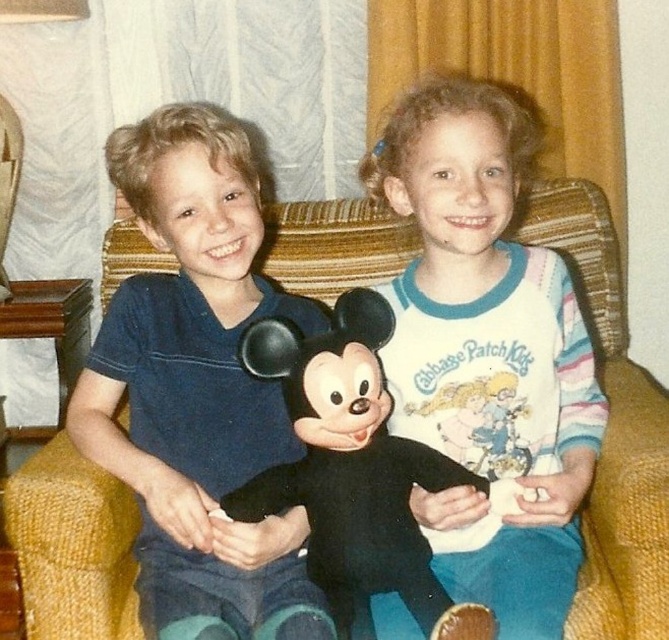
Between yellow fabric couch at center and black plush toy at center, which one appears on the left side from the viewer's perspective?

Positioned to the left is black plush toy at center.

Is yellow fabric couch at center to the right of black plush toy at center from the viewer's perspective?

Correct, you'll find yellow fabric couch at center to the right of black plush toy at center.

What do you see at coordinates (611, 429) in the screenshot? This screenshot has width=669, height=640. I see `yellow fabric couch at center` at bounding box center [611, 429].

The image size is (669, 640). I want to click on yellow fabric couch at center, so click(x=611, y=429).

Between point (199, 257) and point (104, 284), which one is positioned in front?

Point (199, 257) is more forward.

In order to click on matte blue shirt at center in this screenshot , I will do `click(195, 388)`.

Is point (203, 420) closer to camera compared to point (320, 492)?

No, it is behind (320, 492).

Does matte blue shirt at center have a larger size compared to black plush toy at center?

Indeed, matte blue shirt at center has a larger size compared to black plush toy at center.

Find the location of a particular element. matte blue shirt at center is located at coordinates (195, 388).

This screenshot has height=640, width=669. Find the location of `matte blue shirt at center`. matte blue shirt at center is located at coordinates (195, 388).